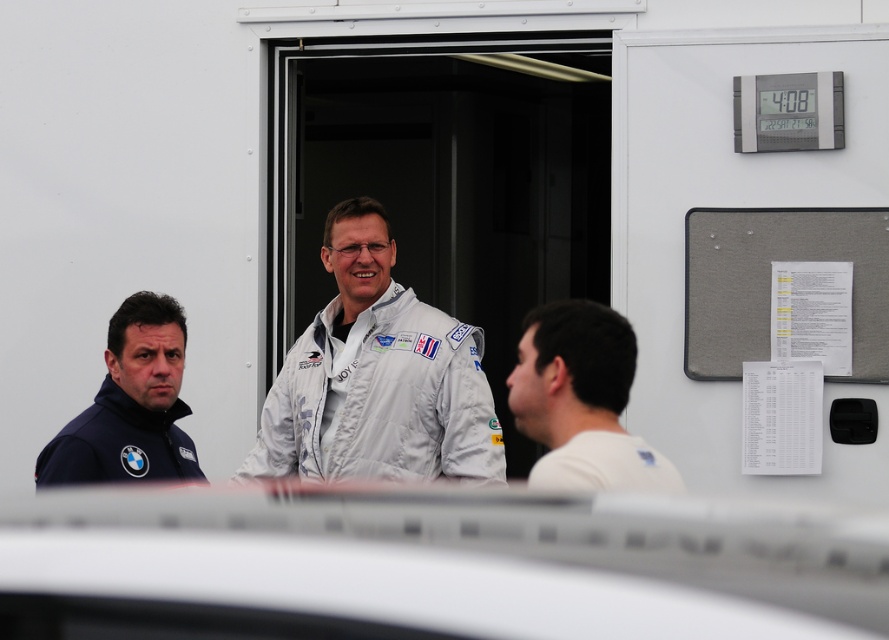
Question: Among these points, which one is nearest to the camera?

Choices:
 (A) (581, 424)
 (B) (342, 433)

Answer: (A)

Question: Can you confirm if white fabric jacket at center is wider than white matte shirt at center?

Choices:
 (A) no
 (B) yes

Answer: (B)

Question: Which object is the farthest from the white matte shirt at center?

Choices:
 (A) dark blue fabric jacket at left
 (B) white fabric jacket at center

Answer: (B)

Question: Among these points, which one is nearest to the camera?

Choices:
 (A) (174, 456)
 (B) (587, 317)
 (C) (335, 321)

Answer: (B)

Question: Is white fabric jacket at center in front of white matte shirt at center?

Choices:
 (A) no
 (B) yes

Answer: (A)

Question: Does white fabric jacket at center appear under white matte shirt at center?

Choices:
 (A) no
 (B) yes

Answer: (A)